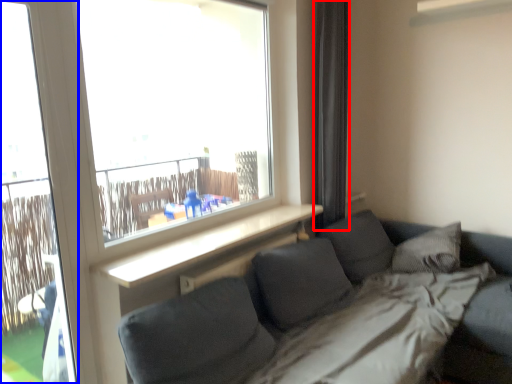
Question: Which object is closer to the camera taking this photo, curtain (highlighted by a red box) or screen door (highlighted by a blue box)?

Choices:
 (A) curtain
 (B) screen door

Answer: (B)